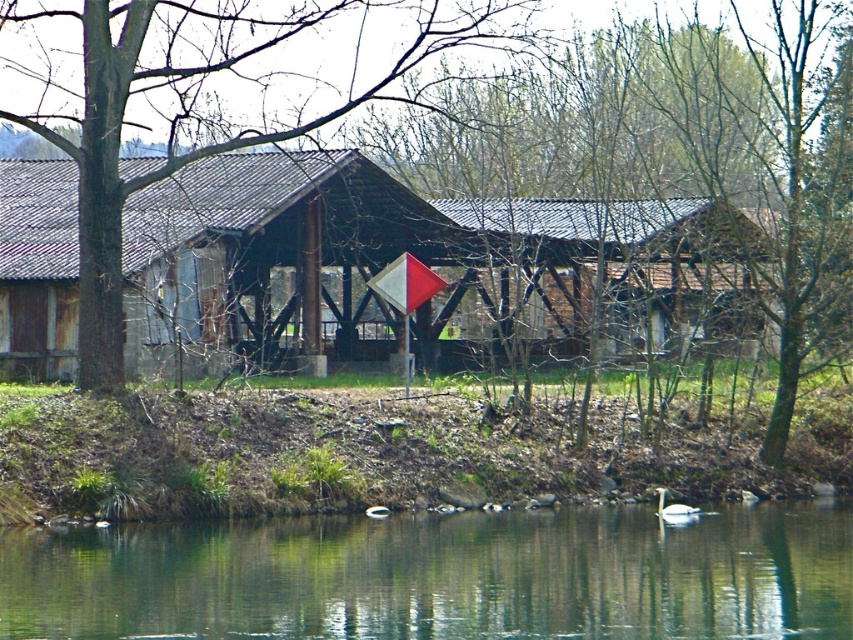
Consider the image. Who is positioned more to the right, brown wood tree at center or white glossy swan at lower center?

From the viewer's perspective, white glossy swan at lower center appears more on the right side.

Between brown wood tree at center and white glossy swan at lower center, which one has less height?

Standing shorter between the two is white glossy swan at lower center.

Is point (306, 74) closer to viewer compared to point (683, 506)?

No, it is not.

In order to click on brown wood tree at center in this screenshot , I will do `click(207, 96)`.

Is green smooth water at lower center shorter than white glossy swan at lower center?

Indeed, green smooth water at lower center has a lesser height compared to white glossy swan at lower center.

Between green smooth water at lower center and white glossy swan at lower center, which one is positioned higher?

white glossy swan at lower center is higher up.

Identify the location of green smooth water at lower center. Image resolution: width=853 pixels, height=640 pixels. (440, 577).

In order to click on green smooth water at lower center in this screenshot , I will do `click(440, 577)`.

In the scene shown: Measure the distance between rusty wood barn at center and white glossy swan at lower center.

A distance of 40.44 feet exists between rusty wood barn at center and white glossy swan at lower center.

The image size is (853, 640). What do you see at coordinates (393, 257) in the screenshot? I see `rusty wood barn at center` at bounding box center [393, 257].

Does point (265, 156) lie behind point (682, 504)?

That is True.

Identify the location of rusty wood barn at center. (393, 257).